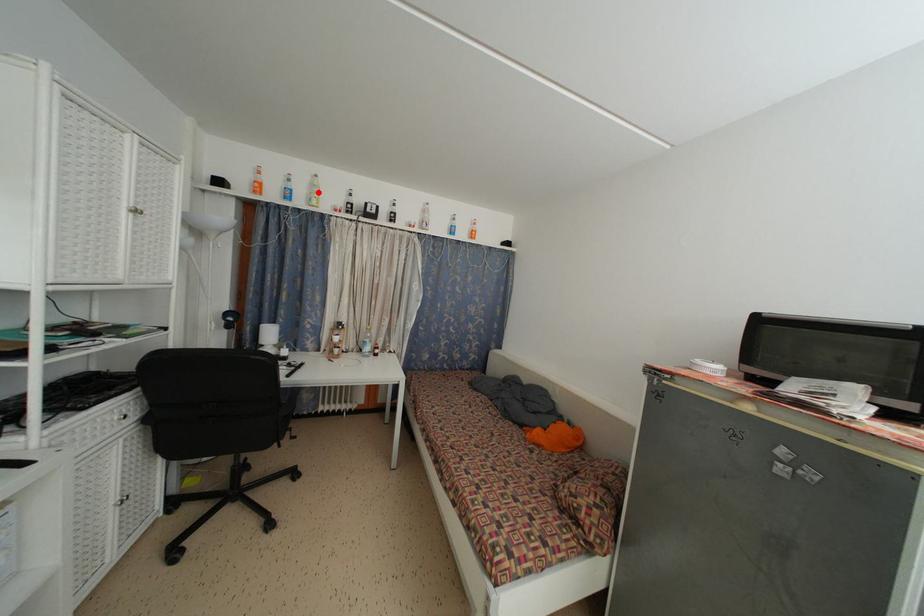
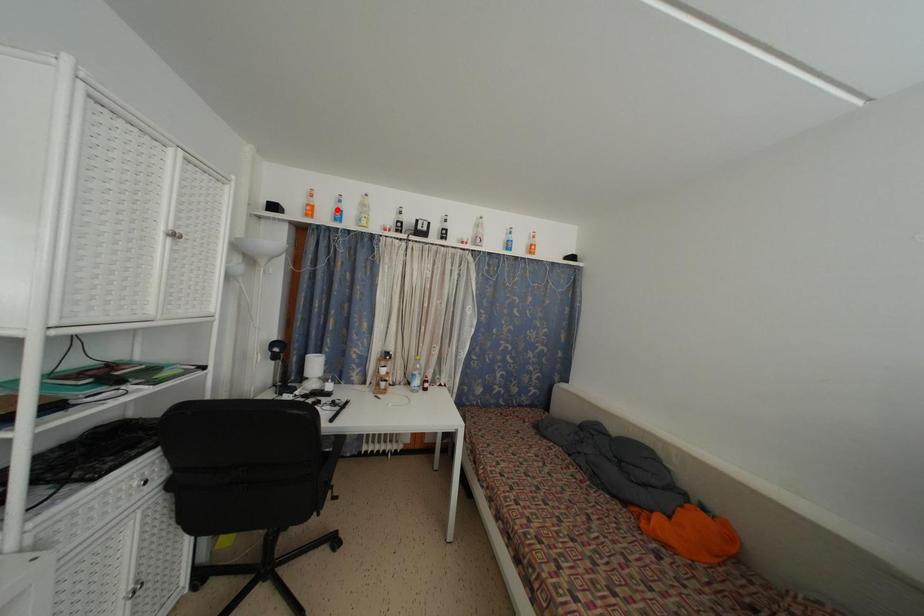
I am providing you with two images of the same scene from different viewpoints. A red point is marked on the first image and another point is marked on the second image. Do the highlighted points in image1 and image2 indicate the same real-world spot?

No